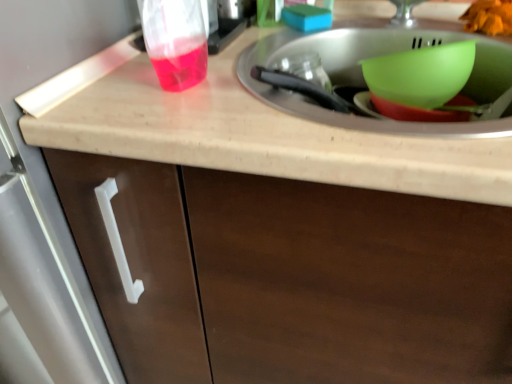
This screenshot has width=512, height=384. I want to click on vacant area that lies to the right of transparent plastic cup at upper left, so click(x=243, y=33).